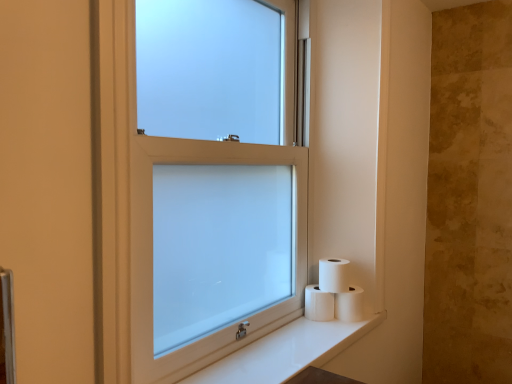
Question: Is white matte toilet paper at lower right, which is the second toilet paper in left-to-right order, to the right of white glossy counter top at lower right from the viewer's perspective?

Choices:
 (A) yes
 (B) no

Answer: (A)

Question: Does white matte toilet paper at lower right, which is the second toilet paper in left-to-right order, touch white glossy counter top at lower right?

Choices:
 (A) no
 (B) yes

Answer: (A)

Question: Is there a large distance between white matte toilet paper at lower right, which is the second toilet paper in left-to-right order, and white glossy counter top at lower right?

Choices:
 (A) yes
 (B) no

Answer: (B)

Question: Is white matte toilet paper at lower right, which ranks as the second toilet paper in right-to-left order, aimed at white glossy counter top at lower right?

Choices:
 (A) yes
 (B) no

Answer: (B)

Question: From the image's perspective, would you say white matte toilet paper at lower right, which ranks as the second toilet paper in right-to-left order, is shown under white glossy counter top at lower right?

Choices:
 (A) yes
 (B) no

Answer: (B)

Question: From the image's perspective, is white frosted glass window at center above or below white matte toilet paper at lower right, placed as the 3th toilet paper when sorted from left to right?

Choices:
 (A) above
 (B) below

Answer: (A)

Question: In terms of width, does white frosted glass window at center look wider or thinner when compared to white matte toilet paper at lower right, which ranks as the 1th toilet paper in right-to-left order?

Choices:
 (A) thin
 (B) wide

Answer: (A)

Question: In terms of height, does white frosted glass window at center look taller or shorter compared to white matte toilet paper at lower right, which ranks as the 1th toilet paper in right-to-left order?

Choices:
 (A) tall
 (B) short

Answer: (A)

Question: Is white frosted glass window at center situated inside white matte toilet paper at lower right, placed as the 3th toilet paper when sorted from left to right, or outside?

Choices:
 (A) inside
 (B) outside

Answer: (B)

Question: Considering their positions, is white matte toilet paper at lower right, which ranks as the second toilet paper in right-to-left order, located in front of or behind white matte toilet paper at lower right, which is the first toilet paper in left-to-right order?

Choices:
 (A) behind
 (B) front

Answer: (B)

Question: Looking at their shapes, would you say white matte toilet paper at lower right, which ranks as the second toilet paper in right-to-left order, is wider or thinner than white matte toilet paper at lower right, which appears as the 3th toilet paper when viewed from the right?

Choices:
 (A) wide
 (B) thin

Answer: (B)

Question: Considering the positions of point (322, 261) and point (314, 304), is point (322, 261) closer or farther from the camera than point (314, 304)?

Choices:
 (A) closer
 (B) farther

Answer: (B)

Question: Is white matte toilet paper at lower right, which is the second toilet paper in left-to-right order, to the left or to the right of white matte toilet paper at lower right, which appears as the 3th toilet paper when viewed from the right, in the image?

Choices:
 (A) right
 (B) left

Answer: (A)

Question: From a real-world perspective, relative to white frosted glass window at center, is white matte toilet paper at lower right, which ranks as the 1th toilet paper in right-to-left order, vertically above or below?

Choices:
 (A) above
 (B) below

Answer: (B)

Question: From the image's perspective, is white matte toilet paper at lower right, placed as the 3th toilet paper when sorted from left to right, above or below white frosted glass window at center?

Choices:
 (A) above
 (B) below

Answer: (B)